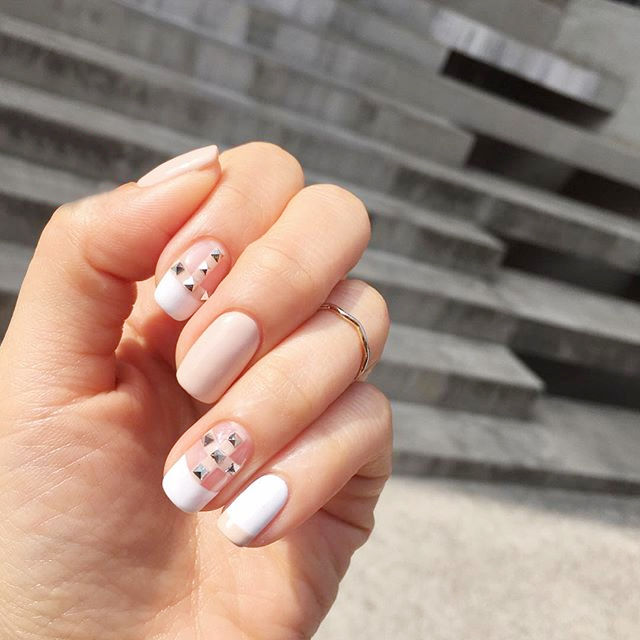
You are a GUI agent. You are given a task and a screenshot of the screen. Output one action in this format:
    pyautogui.click(x=<x>, y=<y>)
    Task: Click on the floor
    Image resolution: width=640 pixels, height=640 pixels.
    Given the screenshot: What is the action you would take?
    pyautogui.click(x=523, y=568)